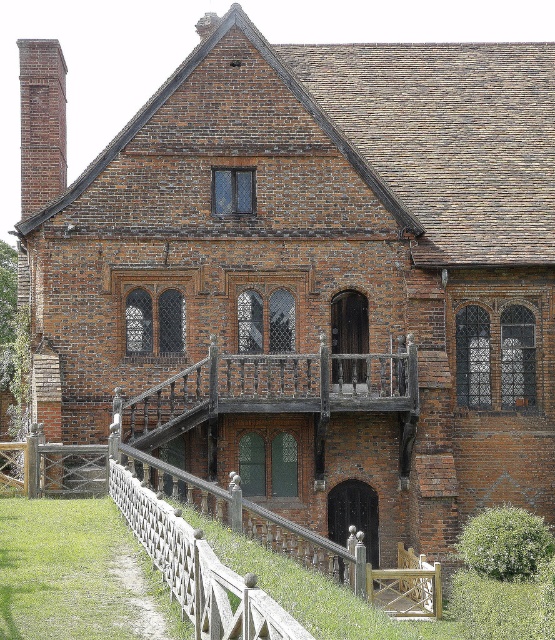
In the scene shown: You are an architect assessing the structural integrity of the building. You need to determine which object between the rustic wood balcony at center and the brick chimney at left has a greater width to ensure safety standards are met. Which one is wider?

The brick chimney at left is wider than the rustic wood balcony at center, so it meets the safety standards for width.

You are standing in front of the historic brick building and notice two points marked on the facade. The first point is at coordinates point (331, 378) and the second is at point (41, 108). Which of these points is nearer to your current position?

Point (331, 378) is closer to the camera than point (41, 108), so the first point is nearer to your current position.